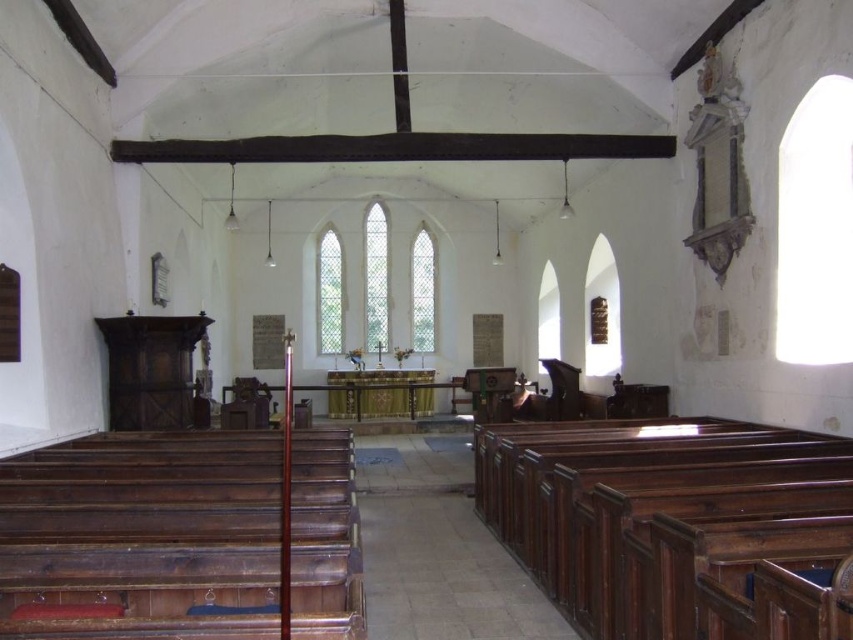
Who is more forward, (679,461) or (30,556)?

Point (30,556)

Is dark brown polished wood church bench at lower right wider than dark brown polished wood church bench at left?

No.

Image resolution: width=853 pixels, height=640 pixels. I want to click on dark brown polished wood church bench at lower right, so click(672, 524).

Who is lower down, dark brown polished wood church bench at left or dark wood beam at center?

dark brown polished wood church bench at left

Looking at this image, who is more distant from viewer, (198, 499) or (675, 147)?

Point (675, 147)

Where is `dark brown polished wood church bench at left`? The width and height of the screenshot is (853, 640). dark brown polished wood church bench at left is located at coordinates click(x=140, y=536).

Which is more to the right, dark brown polished wood church bench at lower right or dark wood beam at center?

dark brown polished wood church bench at lower right is more to the right.

Can you confirm if dark brown polished wood church bench at lower right is smaller than dark wood beam at center?

Yes, dark brown polished wood church bench at lower right is smaller than dark wood beam at center.

Image resolution: width=853 pixels, height=640 pixels. Describe the element at coordinates (672, 524) in the screenshot. I see `dark brown polished wood church bench at lower right` at that location.

You are a GUI agent. You are given a task and a screenshot of the screen. Output one action in this format:
    pyautogui.click(x=<x>, y=<y>)
    Task: Click on the dark brown polished wood church bench at lower right
    Image resolution: width=853 pixels, height=640 pixels.
    Given the screenshot: What is the action you would take?
    pyautogui.click(x=672, y=524)